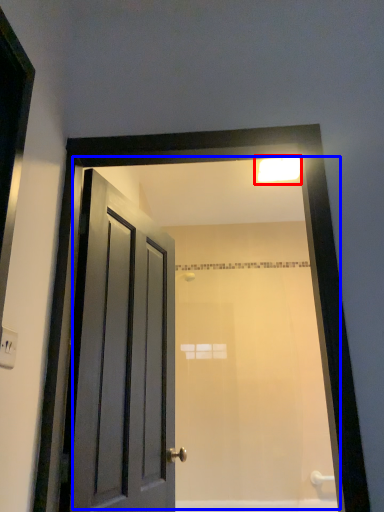
Question: Which point is further to the camera, light fixture (highlighted by a red box) or mirror (highlighted by a blue box)?

Choices:
 (A) light fixture
 (B) mirror

Answer: (A)